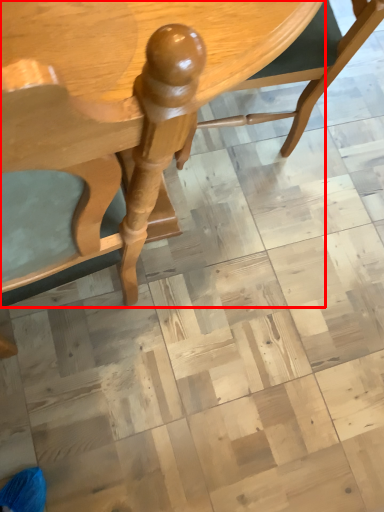
Question: From the image's perspective, where is table (annotated by the red box) located in relation to chair in the image?

Choices:
 (A) above
 (B) below

Answer: (B)